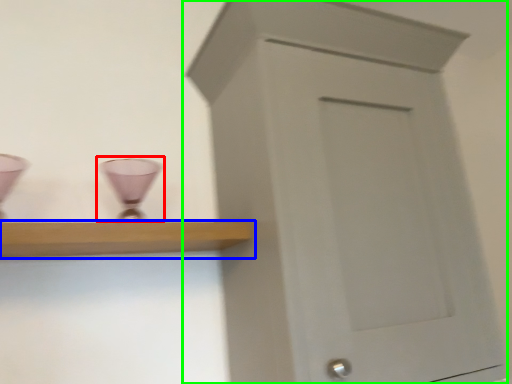
Question: Which object is the farthest from candle holder (highlighted by a red box)? Choose among these: shelf (highlighted by a blue box) or cupboard (highlighted by a green box).

Choices:
 (A) shelf
 (B) cupboard

Answer: (B)